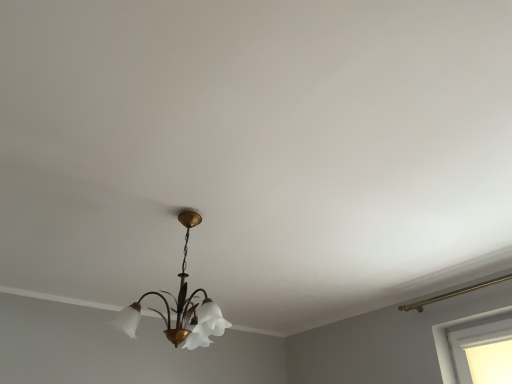
Question: From the image's perspective, is white matte window at lower right positioned above or below matte gold chandelier at center?

Choices:
 (A) below
 (B) above

Answer: (A)

Question: Do you think white matte window at lower right is within matte gold chandelier at center, or outside of it?

Choices:
 (A) inside
 (B) outside

Answer: (B)

Question: Considering their positions, is white matte window at lower right located in front of or behind matte gold chandelier at center?

Choices:
 (A) behind
 (B) front

Answer: (A)

Question: Based on their positions, is matte gold chandelier at center located to the left or right of white matte window at lower right?

Choices:
 (A) right
 (B) left

Answer: (B)

Question: From a real-world perspective, relative to white matte window at lower right, is matte gold chandelier at center vertically above or below?

Choices:
 (A) above
 (B) below

Answer: (A)

Question: Does point (133, 329) appear closer or farther from the camera than point (485, 362)?

Choices:
 (A) farther
 (B) closer

Answer: (A)

Question: Choose the correct answer: Is matte gold chandelier at center inside white matte window at lower right or outside it?

Choices:
 (A) inside
 (B) outside

Answer: (B)